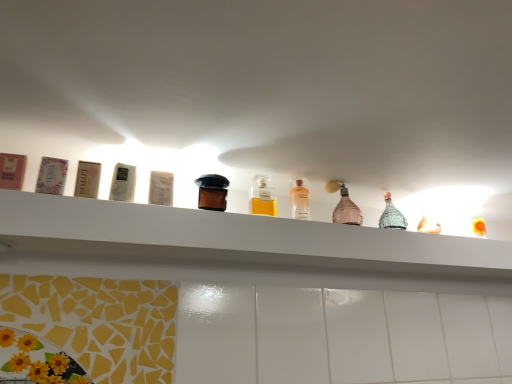
Question: Is yellow glass bottle at center, which is the 3th bottle from right to left, next to pink matte bottle at center, placed as the fourth bottle when sorted from left to right, and touching it?

Choices:
 (A) yes
 (B) no

Answer: (B)

Question: From a real-world perspective, is yellow glass bottle at center, placed as the second bottle when sorted from left to right, located beneath pink matte bottle at center, placed as the fourth bottle when sorted from left to right?

Choices:
 (A) yes
 (B) no

Answer: (A)

Question: Does yellow glass bottle at center, placed as the second bottle when sorted from left to right, have a smaller size compared to pink matte bottle at center, the 1th bottle when ordered from right to left?

Choices:
 (A) no
 (B) yes

Answer: (B)

Question: From a real-world perspective, is yellow glass bottle at center, which is the 3th bottle from right to left, on pink matte bottle at center, placed as the fourth bottle when sorted from left to right?

Choices:
 (A) yes
 (B) no

Answer: (B)

Question: Does yellow glass bottle at center, which is the 3th bottle from right to left, have a lesser height compared to pink matte bottle at center, the 1th bottle when ordered from right to left?

Choices:
 (A) yes
 (B) no

Answer: (A)

Question: Is yellow glass bottle at center, which is the 3th bottle from right to left, aimed at pink matte bottle at center, the 1th bottle when ordered from right to left?

Choices:
 (A) yes
 (B) no

Answer: (B)

Question: From a real-world perspective, is pink matte bottle at center, placed as the fourth bottle when sorted from left to right, on yellow glass bottle at center, which is the 3th bottle from right to left?

Choices:
 (A) yes
 (B) no

Answer: (A)

Question: Would you say pink matte bottle at center, the 1th bottle when ordered from right to left, is outside yellow glass bottle at center, which is the 3th bottle from right to left?

Choices:
 (A) no
 (B) yes

Answer: (B)

Question: Can you confirm if pink matte bottle at center, the 1th bottle when ordered from right to left, is bigger than yellow glass bottle at center, which is the 3th bottle from right to left?

Choices:
 (A) no
 (B) yes

Answer: (B)

Question: Would you say pink matte bottle at center, the 1th bottle when ordered from right to left, is a long distance from yellow glass bottle at center, placed as the second bottle when sorted from left to right?

Choices:
 (A) yes
 (B) no

Answer: (B)

Question: Is pink matte bottle at center, placed as the fourth bottle when sorted from left to right, positioned with its back to yellow glass bottle at center, placed as the second bottle when sorted from left to right?

Choices:
 (A) yes
 (B) no

Answer: (B)

Question: Is yellow glass bottle at center, placed as the second bottle when sorted from left to right, surrounded by pink matte bottle at center, placed as the fourth bottle when sorted from left to right?

Choices:
 (A) no
 (B) yes

Answer: (A)

Question: Considering the relative positions of white glossy shelf at upper center and yellow glass bottle at center, placed as the second bottle when sorted from left to right, in the image provided, is white glossy shelf at upper center to the left of yellow glass bottle at center, placed as the second bottle when sorted from left to right, from the viewer's perspective?

Choices:
 (A) no
 (B) yes

Answer: (A)